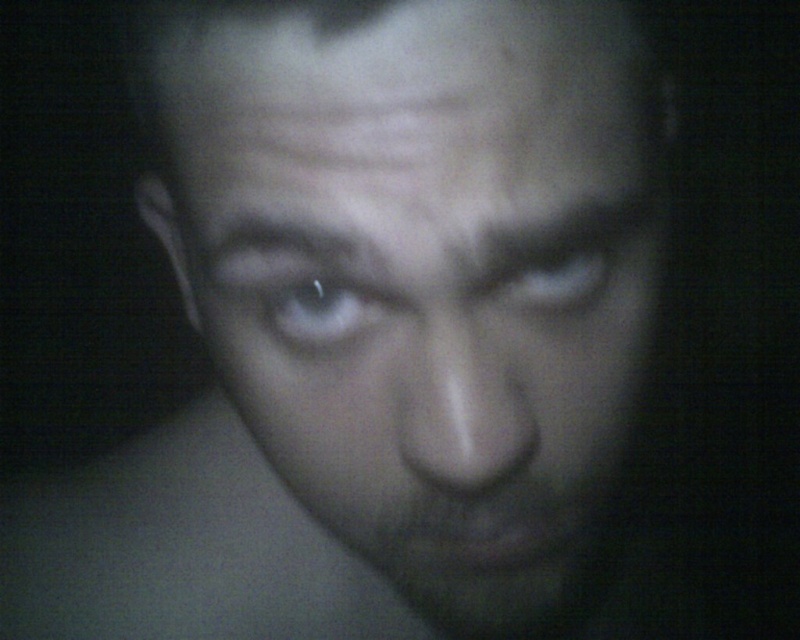
Is smooth skin face at center shorter than white glossy eye at center?

In fact, smooth skin face at center may be taller than white glossy eye at center.

Who is shorter, smooth skin face at center or white glossy eye at center?

With less height is white glossy eye at center.

Does point (464, 336) come in front of point (281, 333)?

Yes, it is in front of point (281, 333).

Locate an element on the screen. This screenshot has width=800, height=640. smooth skin face at center is located at coordinates (424, 273).

Measure the distance between smooth skin face at center and camera.

smooth skin face at center and camera are 22.54 centimeters apart.

Who is more forward, (448, 266) or (582, 243)?

Point (448, 266) is more forward.

You are a GUI agent. You are given a task and a screenshot of the screen. Output one action in this format:
    pyautogui.click(x=<x>, y=<y>)
    Task: Click on the smooth skin face at center
    
    Given the screenshot: What is the action you would take?
    pyautogui.click(x=424, y=273)

Where is `smooth skin face at center`? The width and height of the screenshot is (800, 640). smooth skin face at center is located at coordinates (424, 273).

Is white glossy eye at center wider than matte gray eye at upper center?

In fact, white glossy eye at center might be narrower than matte gray eye at upper center.

Is white glossy eye at center positioned behind matte gray eye at upper center?

No.

Between point (290, 305) and point (560, 304), which one is positioned in front?

Point (290, 305) is more forward.

I want to click on white glossy eye at center, so click(x=320, y=310).